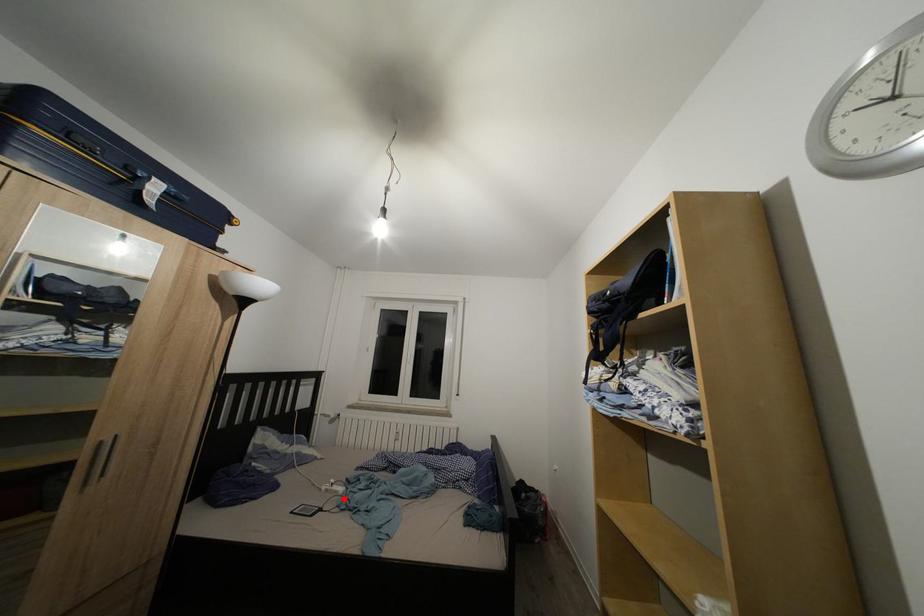
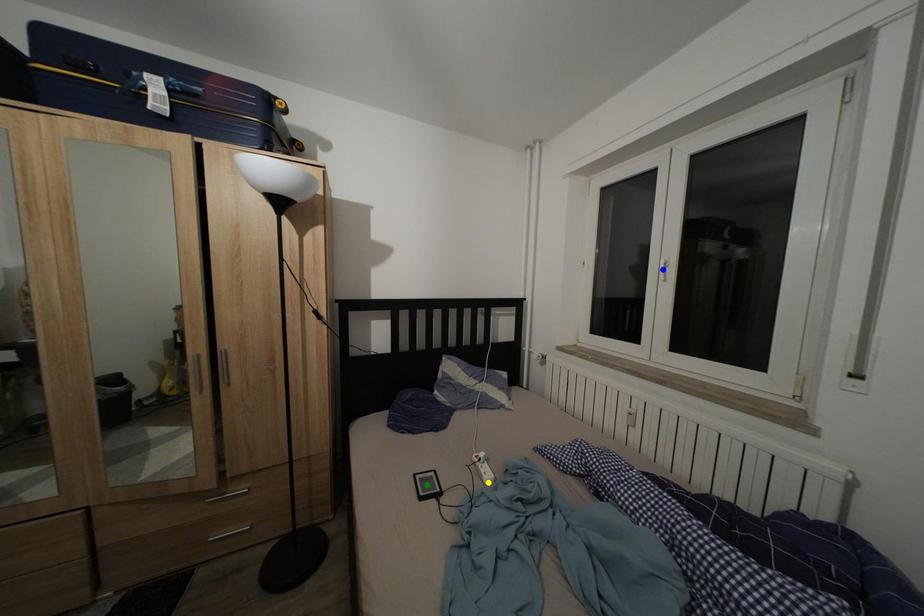
Question: I am providing you with two images of the same scene from different viewpoints. A red point is marked on the first image. You are given multiple points on the second image. Which point in image 2 represents the same 3d spot as the red point in image 1?

Choices:
 (A) green point
 (B) yellow point
 (C) blue point

Answer: (B)